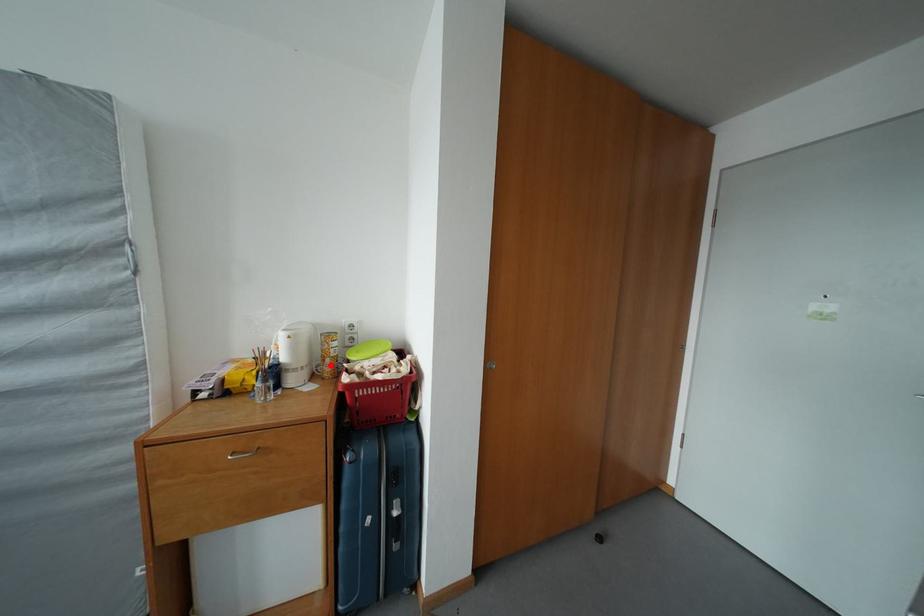
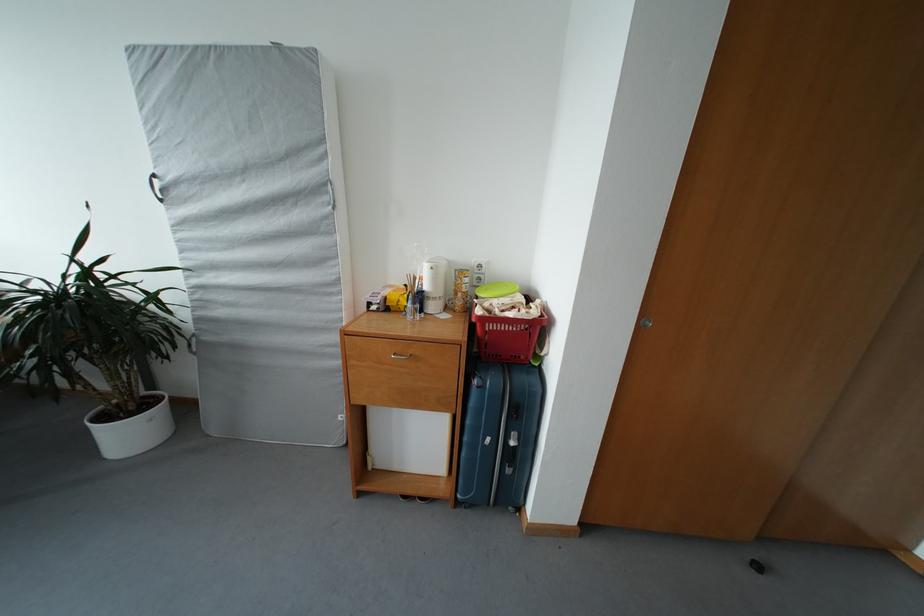
In the second image, find the point that corresponds to the highlighted location in the first image.

(463, 300)